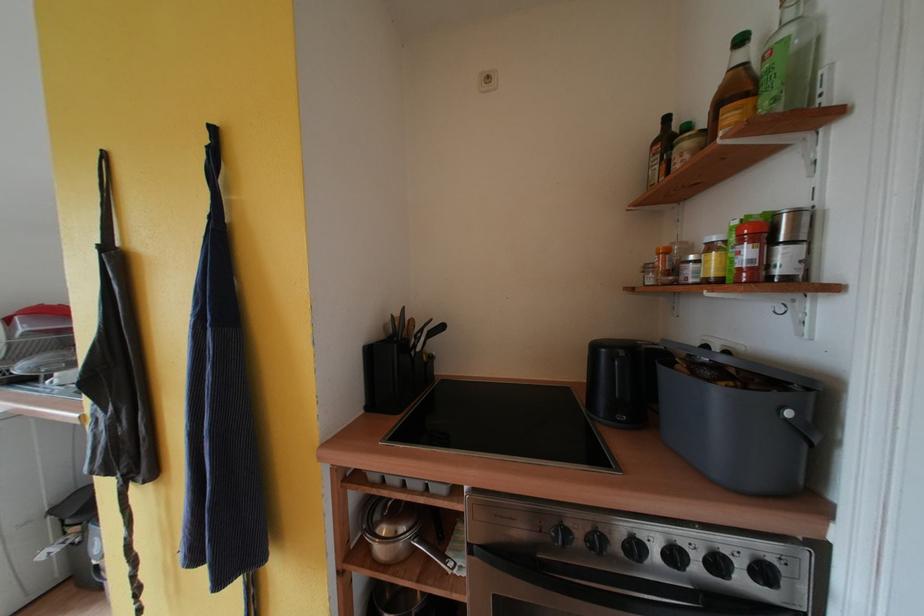
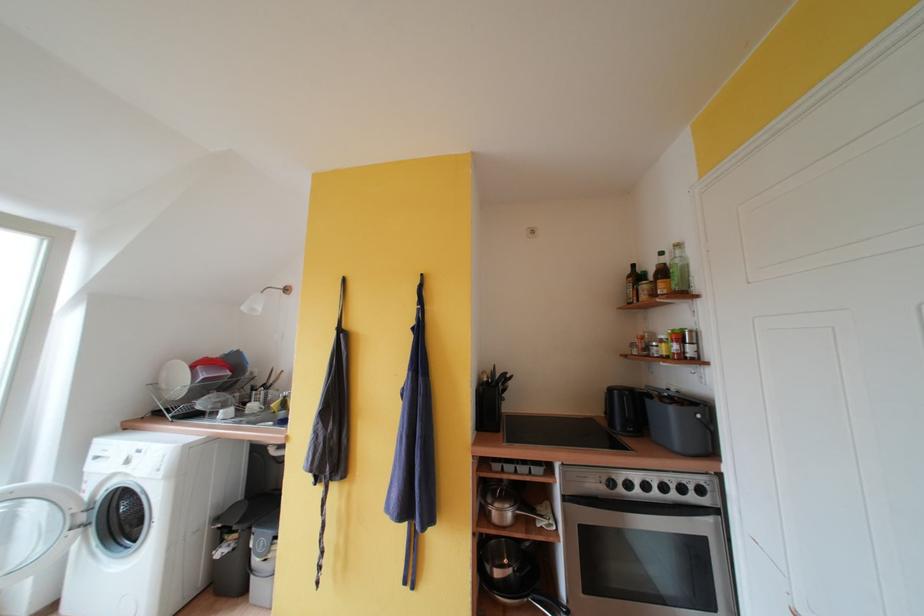
The point at (755, 256) is marked in the first image. Where is the corresponding point in the second image?

(682, 350)